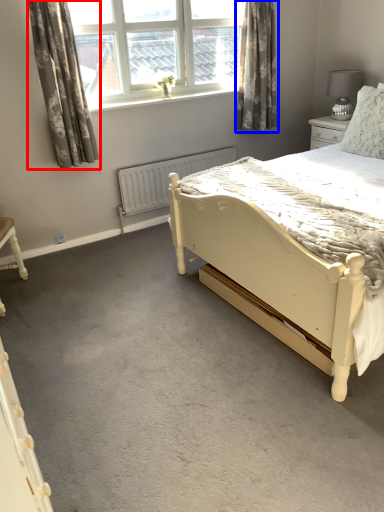
Question: Which point is further to the camera, curtain (highlighted by a red box) or curtain (highlighted by a blue box)?

Choices:
 (A) curtain
 (B) curtain

Answer: (B)